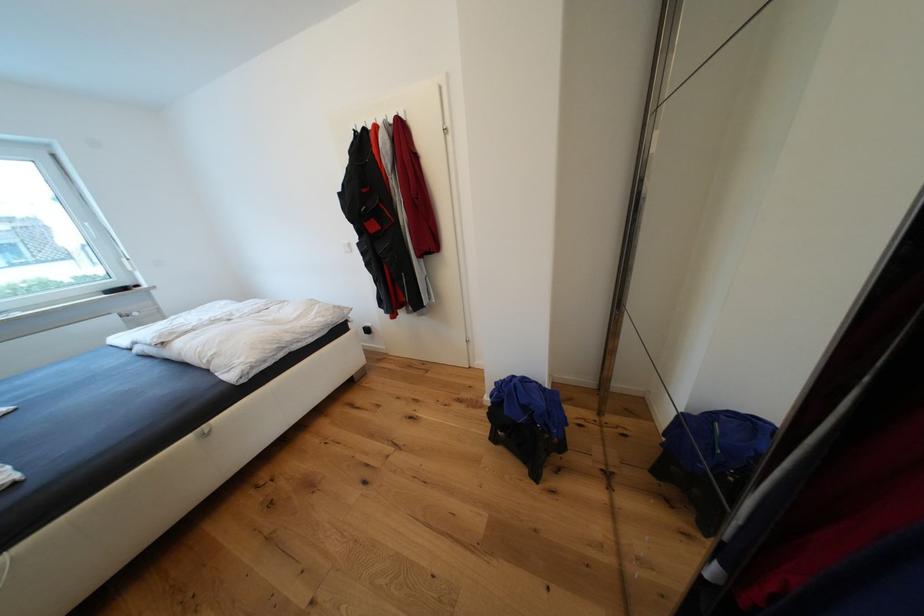
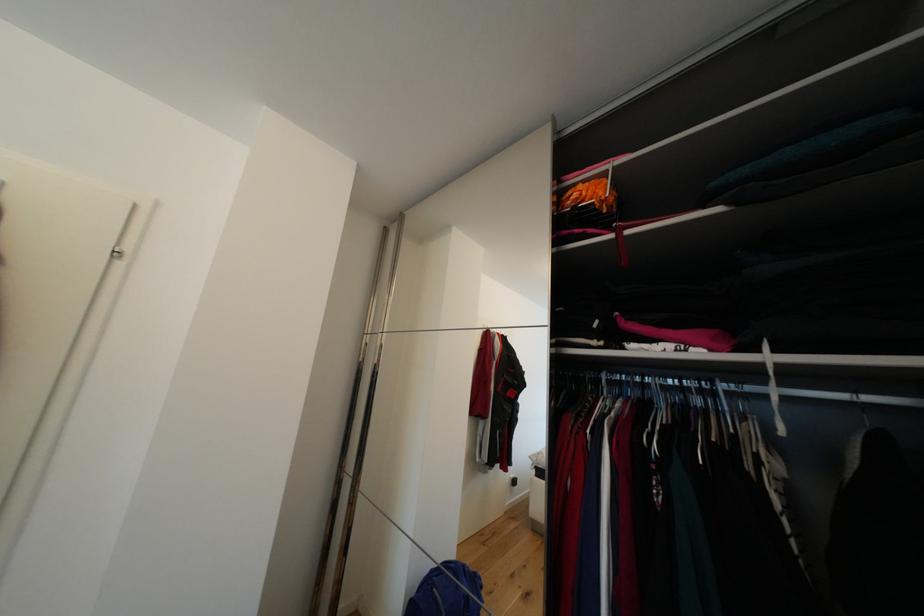
How did the camera likely rotate?

The rotation direction of the camera is right-up.